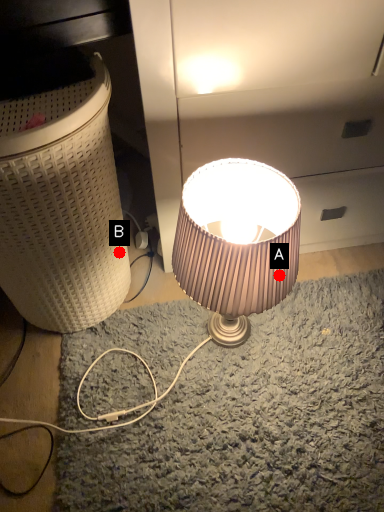
Question: Two points are circled on the image, labeled by A and B beside each circle. Which point appears farthest from the camera in this image?

Choices:
 (A) A is further
 (B) B is further

Answer: (B)